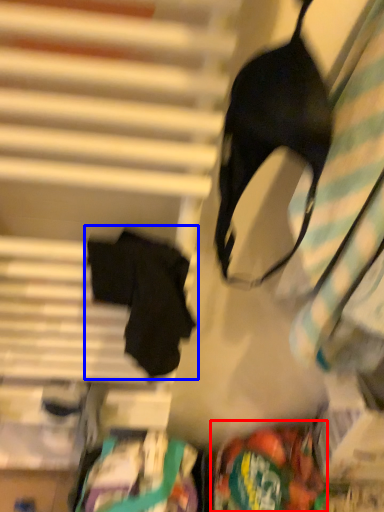
Question: Which object is closer to the camera taking this photo, waste (highlighted by a red box) or robe (highlighted by a blue box)?

Choices:
 (A) waste
 (B) robe

Answer: (B)